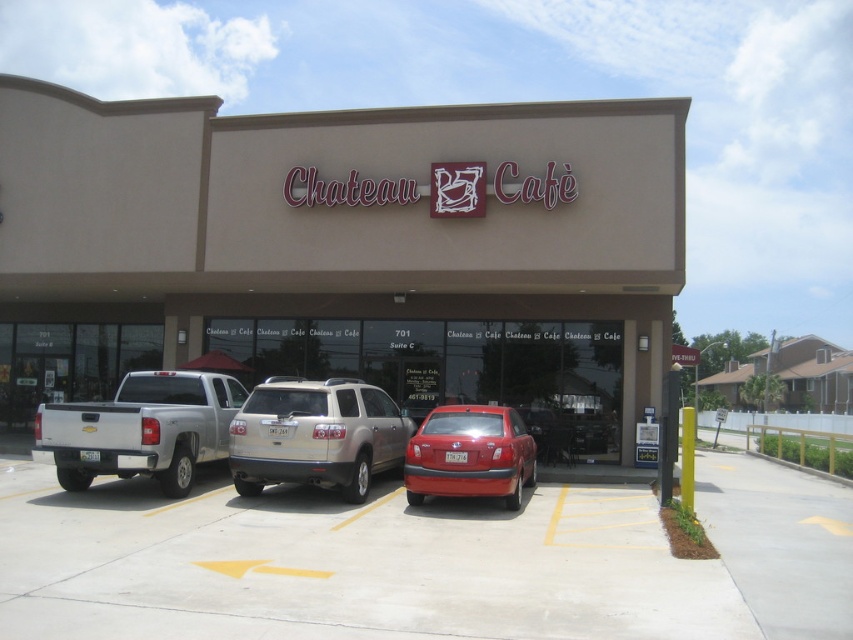
You are a delivery person arriving at the Chateau Cafe. You need to park your delivery van, which is 2 meters wide, in the parking lot. The parking lot has a concrete parking lot at center and a white matte pickup truck at left. Can your van fit in the parking lot at center?

The concrete parking lot at center is larger in size than the white matte pickup truck at left. Since the van is 2 meters wide and the parking lot is larger than the pickup truck, it is likely that the van can fit in the parking lot at center, provided there are no other obstructions.